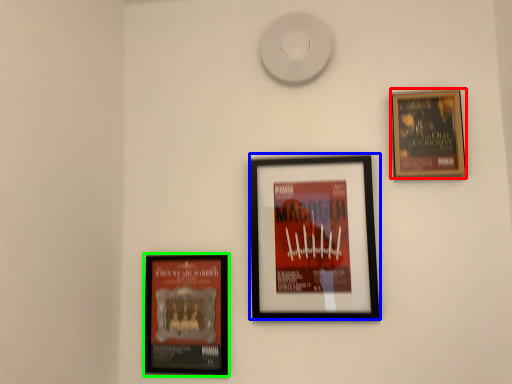
Question: Which object is the farthest from picture frame (highlighted by a red box)? Choose among these: picture frame (highlighted by a blue box) or picture frame (highlighted by a green box).

Choices:
 (A) picture frame
 (B) picture frame

Answer: (B)